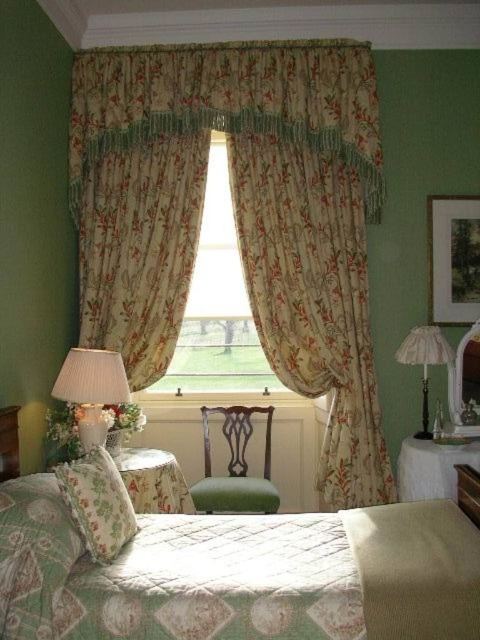
Is point (218, 364) positioned after point (94, 449)?

Yes.

Can you confirm if floral fabric curtain at center is shorter than floral fabric pillow at lower left?

No.

Locate an element on the screen. Image resolution: width=480 pixels, height=640 pixels. floral fabric curtain at center is located at coordinates (218, 292).

Consider the image. Is floral quilted bed at center below floral fabric curtain at center?

Correct, floral quilted bed at center is located below floral fabric curtain at center.

Can you confirm if floral quilted bed at center is smaller than floral fabric curtain at center?

Yes, floral quilted bed at center is smaller than floral fabric curtain at center.

Which is behind, point (146, 564) or point (214, 280)?

The point (214, 280) is more distant.

The height and width of the screenshot is (640, 480). Identify the location of floral quilted bed at center. pos(238,573).

Measure the distance between floral fabric pillow at lower left and camera.

6.64 feet

Can you confirm if floral fabric pillow at lower left is thinner than green fabric chair at center?

Correct, floral fabric pillow at lower left's width is less than green fabric chair at center's.

At what (x,y) coordinates should I click in order to perform the action: click on floral fabric pillow at lower left. Please return your answer as a coordinate pair (x, y). The width and height of the screenshot is (480, 640). Looking at the image, I should click on (97, 502).

The width and height of the screenshot is (480, 640). Identify the location of floral fabric pillow at lower left. (97, 502).